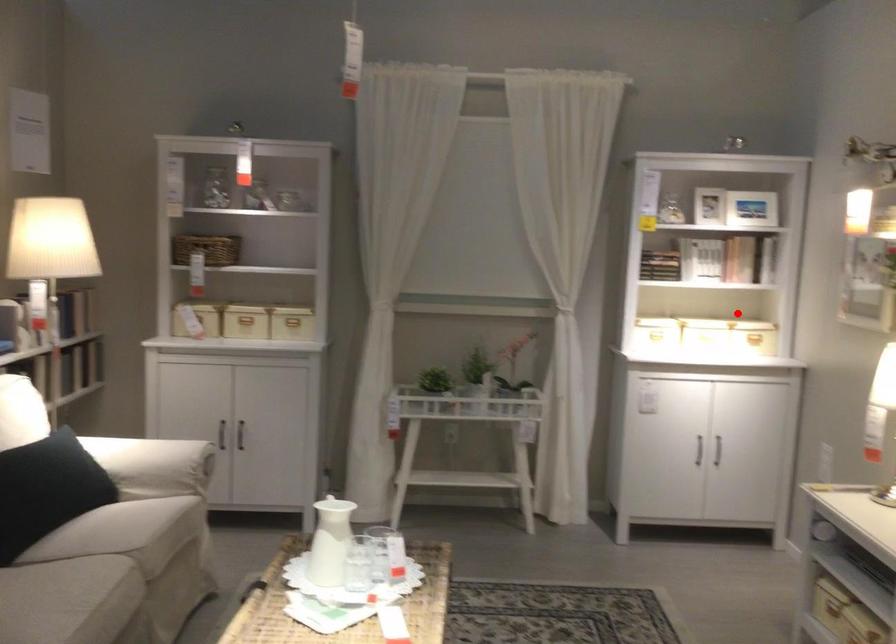
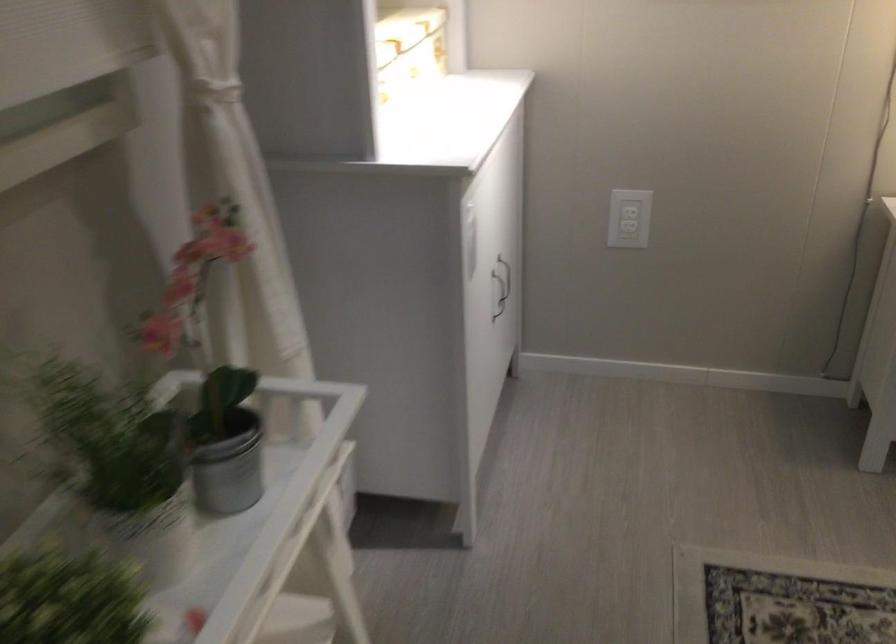
Find the pixel in the second image that matches the highlighted location in the first image.

(410, 44)